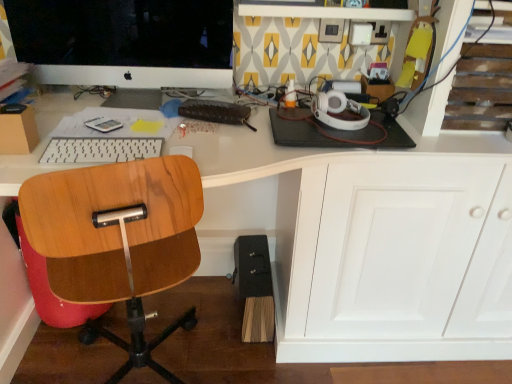
Where is `free space above white plastic keyboard at center (from a real-world perspective)`? free space above white plastic keyboard at center (from a real-world perspective) is located at coordinates (106, 144).